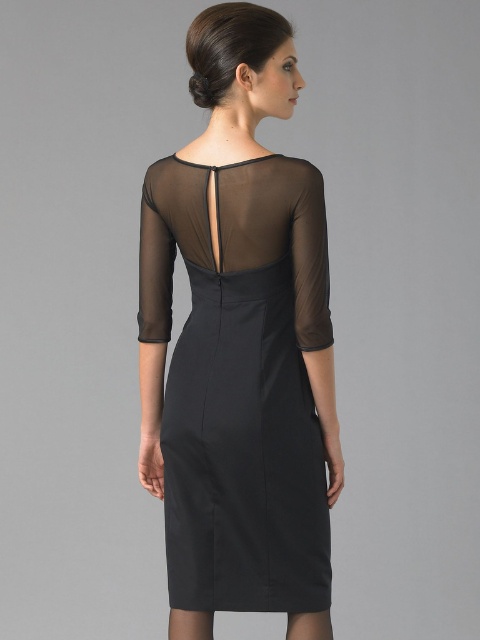
Question: Does black sheer dress at center have a lesser width compared to sheer black sleeve at back?

Choices:
 (A) no
 (B) yes

Answer: (A)

Question: Is black sheer dress at center below sheer black sleeve at back?

Choices:
 (A) no
 (B) yes

Answer: (B)

Question: Which of the following is the closest to the observer?

Choices:
 (A) (312, 243)
 (B) (148, 296)
 (C) (241, 403)

Answer: (A)

Question: Considering the relative positions of sheer brown sleeve at right and sheer black sleeve at back in the image provided, where is sheer brown sleeve at right located with respect to sheer black sleeve at back?

Choices:
 (A) above
 (B) below

Answer: (B)

Question: Estimate the real-world distances between objects in this image. Which object is farther from the sheer brown sleeve at right?

Choices:
 (A) black sheer dress at center
 (B) sheer black sleeve at back

Answer: (B)

Question: Among these points, which one is farthest from the camera?

Choices:
 (A) (300, 326)
 (B) (173, 563)

Answer: (B)